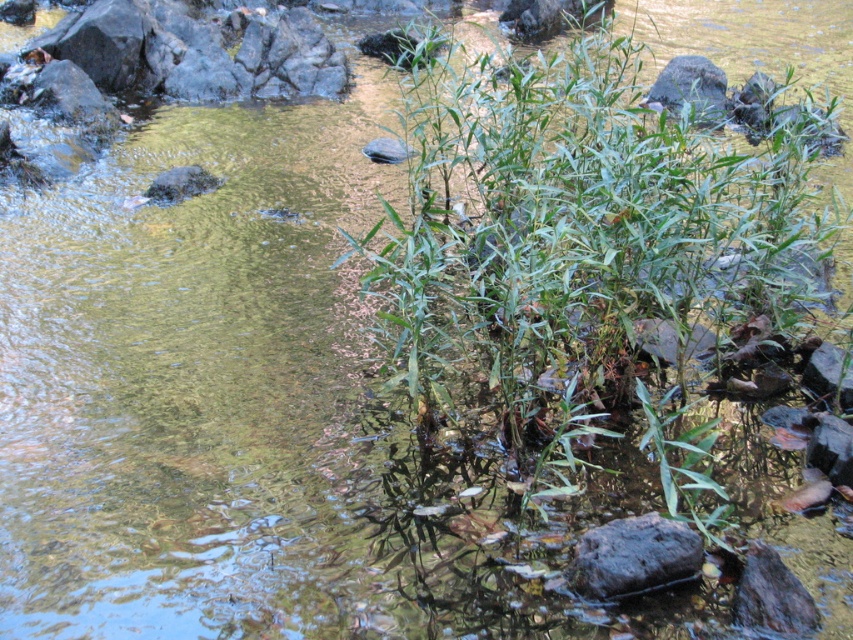
Does green leafy plant at center have a smaller size compared to dark gray rock at center?

No.

How far apart are green leafy plant at center and dark gray rock at center?

They are 1.19 meters apart.

You are a GUI agent. You are given a task and a screenshot of the screen. Output one action in this format:
    pyautogui.click(x=<x>, y=<y>)
    Task: Click on the green leafy plant at center
    
    Given the screenshot: What is the action you would take?
    pyautogui.click(x=601, y=285)

You are a GUI agent. You are given a task and a screenshot of the screen. Output one action in this format:
    pyautogui.click(x=<x>, y=<y>)
    Task: Click on the green leafy plant at center
    
    Given the screenshot: What is the action you would take?
    pyautogui.click(x=601, y=285)